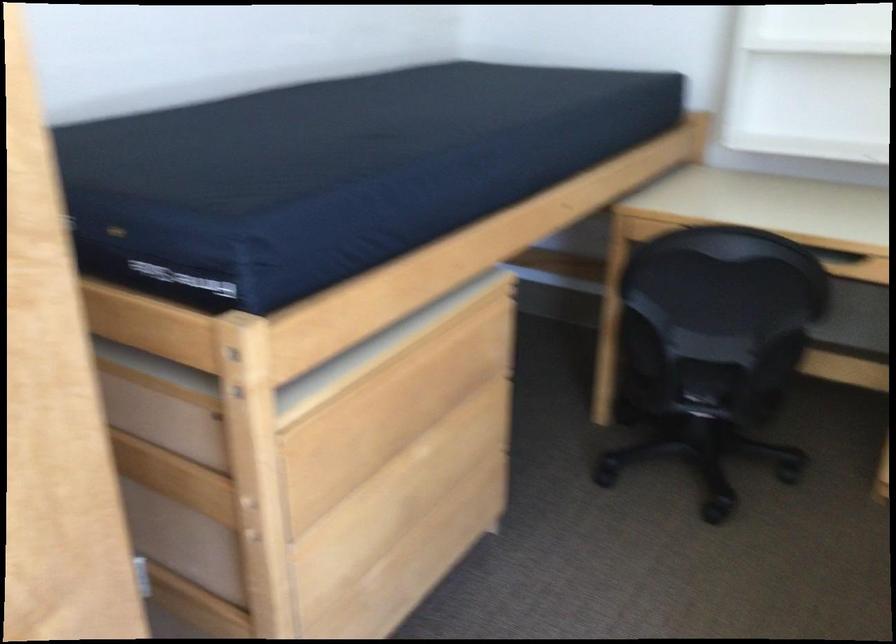
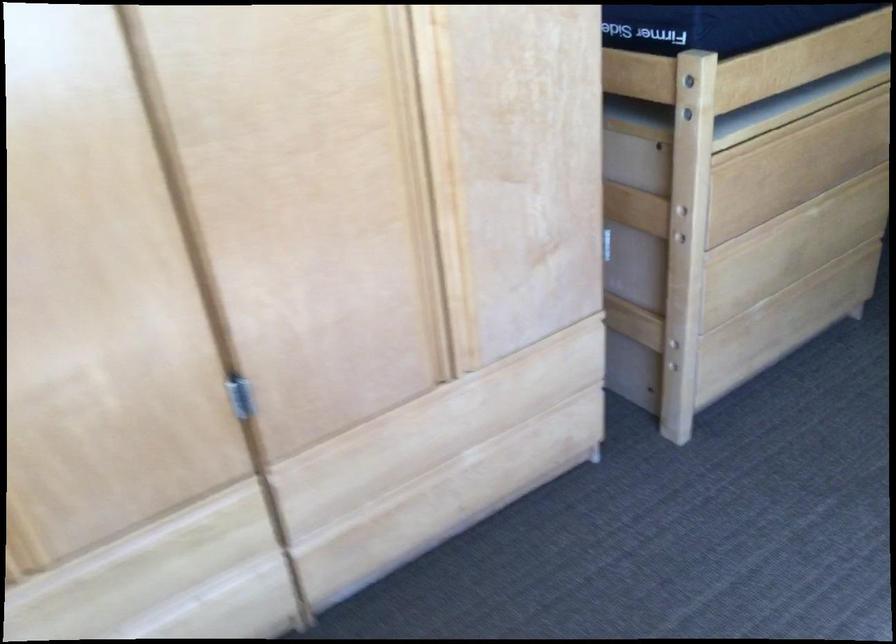
Find the pixel in the second image that matches pixel 238 363 in the first image.

(687, 82)